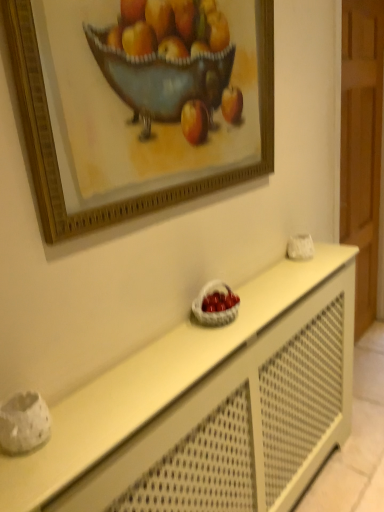
Find the location of a particular element. The height and width of the screenshot is (512, 384). vacant space situated on the left part of white woven basket at center is located at coordinates (167, 337).